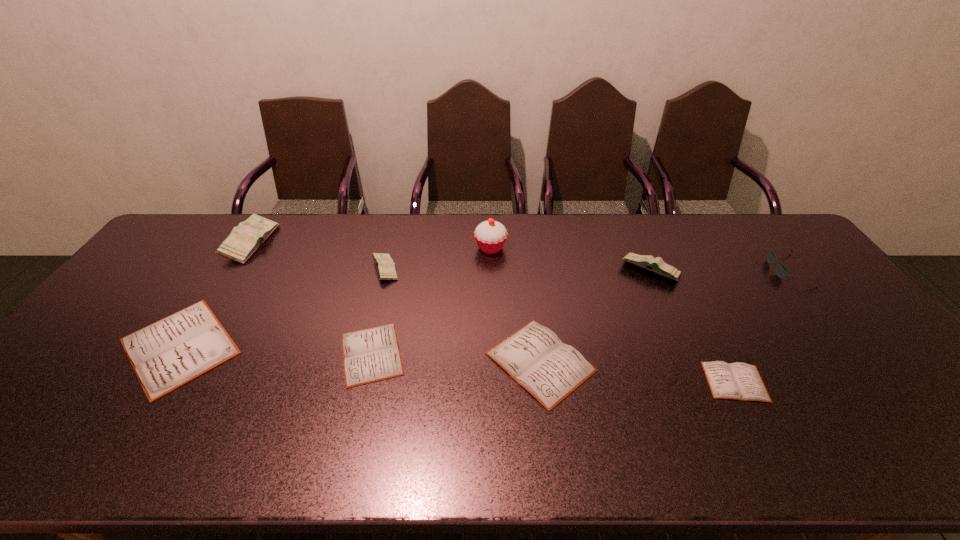
Where is `vacant space positioned on the left of the seventh shortest object`? Image resolution: width=960 pixels, height=540 pixels. vacant space positioned on the left of the seventh shortest object is located at coordinates (562, 271).

Find the location of a particular element. free space located on the lenses of the sunglasses is located at coordinates (671, 269).

You are a GUI agent. You are given a task and a screenshot of the screen. Output one action in this format:
    pyautogui.click(x=<x>, y=<y>)
    Task: Click on the free space located 0.170m on the lenses of the sunglasses
    
    Given the screenshot: What is the action you would take?
    (719, 269)

Find the location of a particular element. The height and width of the screenshot is (540, 960). vacant space located on the lenses of the sunglasses is located at coordinates [659, 269].

Identify the location of vacant space located on the right of the fifth shortest diary. (498, 269).

Locate an element on the screen. The height and width of the screenshot is (540, 960). vacant space located 0.110m on the left of the biggest white diary is located at coordinates (74, 346).

This screenshot has width=960, height=540. Find the location of `blank area located 0.110m on the right of the second white diary from right to left`. blank area located 0.110m on the right of the second white diary from right to left is located at coordinates pos(638,362).

The image size is (960, 540). In order to click on free spot located on the right of the second white diary from left to right in this screenshot , I will do `click(469, 354)`.

Where is `free spot located 0.060m on the left of the shortest diary`? The height and width of the screenshot is (540, 960). free spot located 0.060m on the left of the shortest diary is located at coordinates (682, 382).

Where is `cupcake located at the far edge`? cupcake located at the far edge is located at coordinates (490, 235).